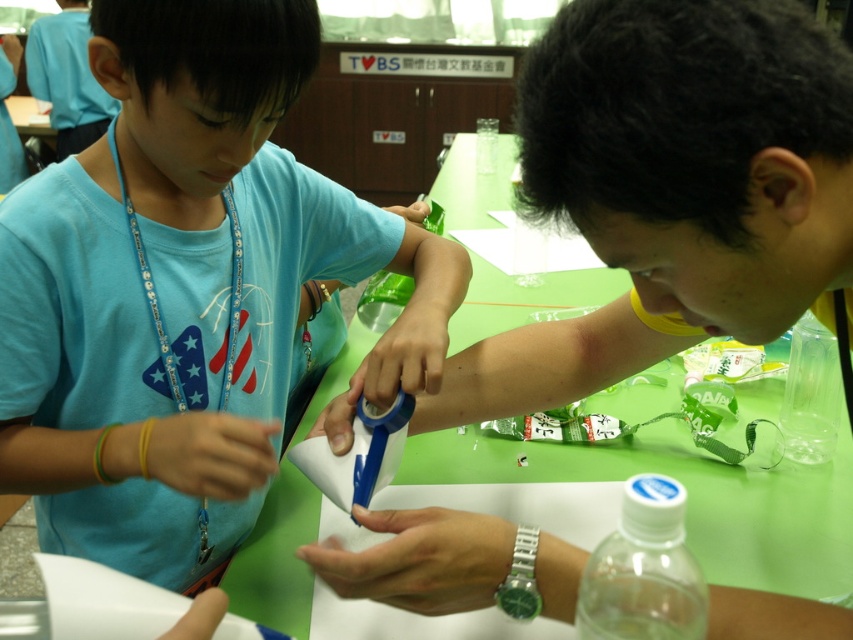
Question: Does clear plastic bottle at center have a lesser width compared to transparent plastic bottle at center?

Choices:
 (A) yes
 (B) no

Answer: (B)

Question: Can you confirm if matte blue t-shirt at left is smaller than transparent plastic bottle at center?

Choices:
 (A) no
 (B) yes

Answer: (A)

Question: Which point is closer to the camera taking this photo?

Choices:
 (A) (741, 570)
 (B) (816, 365)
 (C) (733, 76)
 (D) (639, 524)

Answer: (D)

Question: Which is farther from the blue matte tape dispenser at center?

Choices:
 (A) matte blue t-shirt at left
 (B) transparent plastic bottle at center
 (C) green plastic table at center
 (D) clear plastic bottle at center

Answer: (B)

Question: Considering the real-world distances, which object is closest to the blue matte tape dispenser at center?

Choices:
 (A) green plastic table at center
 (B) matte blue t-shirt at left
 (C) transparent plastic bottle at center
 (D) clear plastic bottle at center

Answer: (B)

Question: Is matte blue t-shirt at left wider than clear plastic bottle at center?

Choices:
 (A) no
 (B) yes

Answer: (B)